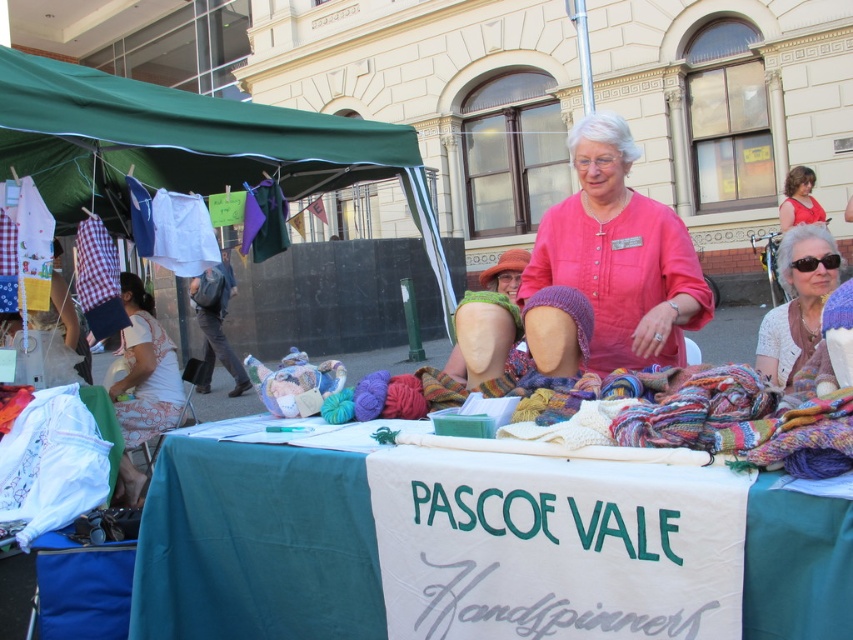
Question: Based on their relative distances, which object is farther from the white cloth at center?

Choices:
 (A) green fabric canopy at upper left
 (B) matte red blouse at upper right
 (C) sunglasses fabric at upper right
 (D) leather bag at center

Answer: (B)

Question: Which object appears closest to the camera in this image?

Choices:
 (A) green fabric canopy at upper left
 (B) white floral dress at lower left

Answer: (A)

Question: Where is leather bag at center located in relation to matte red blouse at upper right in the image?

Choices:
 (A) left
 (B) right

Answer: (A)

Question: Does green fabric canopy at upper left appear under white floral dress at lower left?

Choices:
 (A) yes
 (B) no

Answer: (B)

Question: Does white cloth at center appear over green fabric canopy at upper left?

Choices:
 (A) yes
 (B) no

Answer: (B)

Question: Which point appears closest to the camera in this image?

Choices:
 (A) (368, 536)
 (B) (610, 124)

Answer: (A)